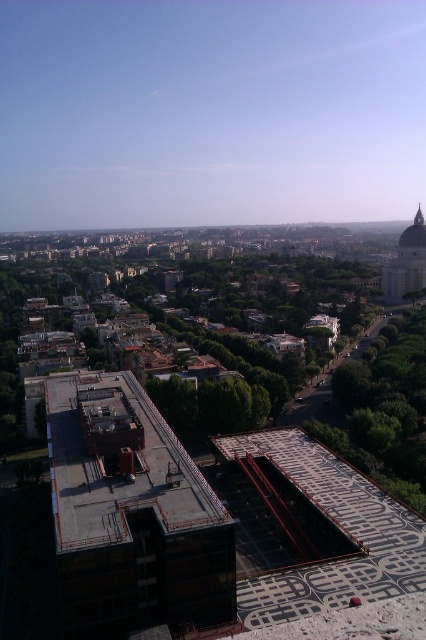
You are an architect reviewing a city plan and notice two domes in the distance. The scene includes a white marble dome at upper right and a matte white dome at upper right. Which of these two domes is positioned to the left when viewed from your perspective?

The white marble dome at upper right is positioned to the left of the matte white dome at upper right.

You are a drone operator tasked with capturing aerial footage of the city. You need to position your drone to focus on the white marble dome at upper right. According to the coordinates provided, where should you direct the drone to ensure it is centered in the frame?

The white marble dome at upper right is located at point (406, 260), so you should direct the drone to that coordinate to center it in the frame.

You are standing on the rooftop of the building under construction and looking at two points marked in the image. Which point, point [408,246] or point [399,237], is closer to you?

Point [408,246] is closer to you than point [399,237].